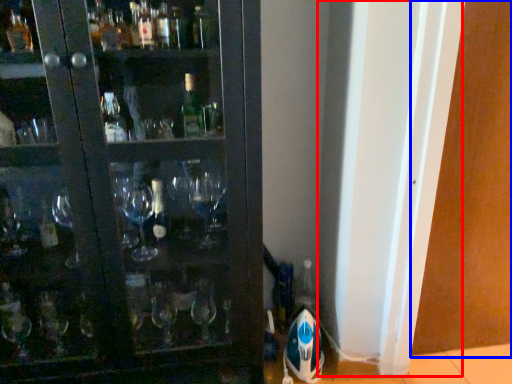
Question: Which object is further to the camera taking this photo, screen door (highlighted by a red box) or screen door (highlighted by a blue box)?

Choices:
 (A) screen door
 (B) screen door

Answer: (B)